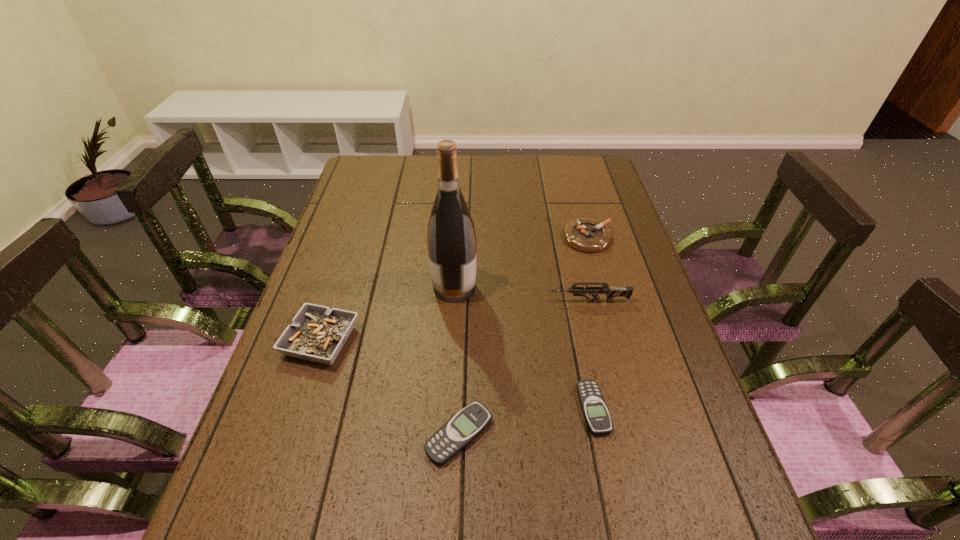
Identify the location of free space located on the back of the taller beeper. (465, 288).

The height and width of the screenshot is (540, 960). Find the location of `free location located on the left of the shortest object`. free location located on the left of the shortest object is located at coordinates (443, 408).

Identify the location of vacant region located 0.260m on the label of the wine bottle. This screenshot has height=540, width=960. (573, 288).

The image size is (960, 540). Find the location of `vacant space located 0.110m on the front of the right ashtray`. vacant space located 0.110m on the front of the right ashtray is located at coordinates (599, 280).

At what (x,y) coordinates should I click in order to perform the action: click on vacant space located aimed along the barrel of the gun. Please return your answer as a coordinate pair (x, y). This screenshot has height=540, width=960. Looking at the image, I should click on (490, 301).

Identify the location of vacant area located aimed along the barrel of the gun. (428, 301).

At what (x,y) coordinates should I click in order to perform the action: click on vacant area situated aimed along the barrel of the gun. Please return your answer as a coordinate pair (x, y). This screenshot has width=960, height=540. Looking at the image, I should click on (440, 301).

You are a GUI agent. You are given a task and a screenshot of the screen. Output one action in this format:
    pyautogui.click(x=<x>, y=<y>)
    Task: Click on the free space located 0.060m on the front of the leftmost object
    Image resolution: width=960 pixels, height=540 pixels.
    Given the screenshot: What is the action you would take?
    pyautogui.click(x=303, y=395)

At what (x,y) coordinates should I click in order to perform the action: click on object at the near edge. Please return your answer as a coordinate pair (x, y). Looking at the image, I should click on (458, 432).

The image size is (960, 540). I want to click on object that is at the left edge, so click(317, 333).